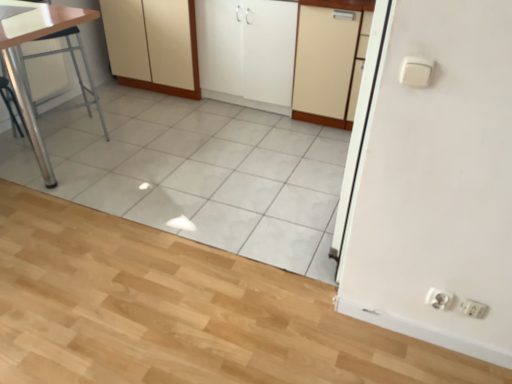
What do you see at coordinates (12, 11) in the screenshot?
I see `white glossy sink at upper left` at bounding box center [12, 11].

Describe the element at coordinates (330, 60) in the screenshot. I see `beige matte cabinet at center, the third cabinetry when ordered from left to right` at that location.

Describe the element at coordinates (153, 45) in the screenshot. This screenshot has height=384, width=512. I see `white matte cabinet at center, the 3th cabinetry when ordered from right to left` at that location.

What do you see at coordinates (473, 308) in the screenshot? I see `white plastic electric outlet at lower right, the second electric outlet positioned from the left` at bounding box center [473, 308].

This screenshot has width=512, height=384. In order to click on metallic silver table at left in this screenshot , I will do `click(18, 67)`.

Considering the positions of objects metallic silver table at left and white matte cabinet at center, the 3th cabinetry when ordered from right to left, in the image provided, who is more to the right, metallic silver table at left or white matte cabinet at center, the 3th cabinetry when ordered from right to left,?

From the viewer's perspective, white matte cabinet at center, the 3th cabinetry when ordered from right to left, appears more on the right side.

From the image's perspective, would you say metallic silver table at left is positioned over white matte cabinet at center, the first cabinetry from the left?

No.

Considering the relative sizes of metallic silver table at left and white matte cabinet at center, the first cabinetry from the left, in the image provided, is metallic silver table at left shorter than white matte cabinet at center, the first cabinetry from the left,?

No.

Which is more to the right, beige matte cabinet at center, the third cabinetry when ordered from left to right, or white plastic electric outlet at lower right, the 1th electric outlet in the left-to-right sequence?

Positioned to the right is white plastic electric outlet at lower right, the 1th electric outlet in the left-to-right sequence.

Is beige matte cabinet at center, the third cabinetry when ordered from left to right, bigger than white plastic electric outlet at lower right, the 1th electric outlet in the left-to-right sequence?

Correct, beige matte cabinet at center, the third cabinetry when ordered from left to right, is larger in size than white plastic electric outlet at lower right, the 1th electric outlet in the left-to-right sequence.

Does beige matte cabinet at center, which is the 1th cabinetry from right to left, come behind white plastic electric outlet at lower right, the 1th electric outlet in the left-to-right sequence?

Yes, beige matte cabinet at center, which is the 1th cabinetry from right to left, is further from the viewer.

Would you say white plastic electric outlet at lower right, the second electric outlet positioned from the left, is inside or outside white plastic electric outlet at lower right, the 1th electric outlet in the left-to-right sequence?

white plastic electric outlet at lower right, the second electric outlet positioned from the left, cannot be found inside white plastic electric outlet at lower right, the 1th electric outlet in the left-to-right sequence.

From a real-world perspective, between white plastic electric outlet at lower right, the second electric outlet positioned from the left, and white plastic electric outlet at lower right, positioned as the second electric outlet in right-to-left order, who is vertically higher?

white plastic electric outlet at lower right, positioned as the second electric outlet in right-to-left order, from a real-world perspective.

Which is closer, [463,310] or [435,295]?

Clearly, point [463,310] is closer to the camera than point [435,295].

Is white plastic electric outlet at lower right, the second electric outlet positioned from the left, bigger or smaller than white plastic electric outlet at lower right, positioned as the second electric outlet in right-to-left order?

Clearly, white plastic electric outlet at lower right, the second electric outlet positioned from the left, is smaller in size than white plastic electric outlet at lower right, positioned as the second electric outlet in right-to-left order.

Considering the positions of points (466, 305) and (14, 8), is point (466, 305) farther from camera compared to point (14, 8)?

That is False.

From the image's perspective, between white plastic electric outlet at lower right, the second electric outlet positioned from the left, and white glossy sink at upper left, which one is located above?

white glossy sink at upper left.

I want to click on sink above the white plastic electric outlet at lower right, which is counted as the first electric outlet, starting from the right (from a real-world perspective), so click(x=12, y=11).

Is white plastic electric outlet at lower right, the second electric outlet positioned from the left, at the left side of white glossy sink at upper left?

No.

From the image's perspective, which object appears higher, metallic silver table at left or white plastic electric outlet at lower right, which is counted as the first electric outlet, starting from the right?

metallic silver table at left.

Between metallic silver table at left and white plastic electric outlet at lower right, which is counted as the first electric outlet, starting from the right, which one has smaller width?

With smaller width is white plastic electric outlet at lower right, which is counted as the first electric outlet, starting from the right.

At what (x,y) coordinates should I click in order to perform the action: click on table that appears above the white plastic electric outlet at lower right, which is counted as the first electric outlet, starting from the right (from the image's perspective). Please return your answer as a coordinate pair (x, y). Looking at the image, I should click on (18, 67).

Can you tell me how much metallic silver table at left and beige matte cabinet at center, the third cabinetry when ordered from left to right, differ in facing direction?

61.6 degrees separate the facing orientations of metallic silver table at left and beige matte cabinet at center, the third cabinetry when ordered from left to right.

Does metallic silver table at left come in front of beige matte cabinet at center, the third cabinetry when ordered from left to right?

That is True.

Looking at their sizes, would you say metallic silver table at left is wider or thinner than beige matte cabinet at center, which is the 1th cabinetry from right to left?

Considering their sizes, metallic silver table at left looks slimmer than beige matte cabinet at center, which is the 1th cabinetry from right to left.

From the image's perspective, which is above, white plastic electric outlet at lower right, the 1th electric outlet in the left-to-right sequence, or beige matte cabinet at center, which is the 1th cabinetry from right to left?

beige matte cabinet at center, which is the 1th cabinetry from right to left, from the image's perspective.

Considering the relative positions of white plastic electric outlet at lower right, positioned as the second electric outlet in right-to-left order, and beige matte cabinet at center, which is the 1th cabinetry from right to left, in the image provided, is white plastic electric outlet at lower right, positioned as the second electric outlet in right-to-left order, to the left or to the right of beige matte cabinet at center, which is the 1th cabinetry from right to left,?

Clearly, white plastic electric outlet at lower right, positioned as the second electric outlet in right-to-left order, is on the right of beige matte cabinet at center, which is the 1th cabinetry from right to left, in the image.

Is white plastic electric outlet at lower right, positioned as the second electric outlet in right-to-left order, wider than beige matte cabinet at center, which is the 1th cabinetry from right to left?

Incorrect, the width of white plastic electric outlet at lower right, positioned as the second electric outlet in right-to-left order, does not surpass that of beige matte cabinet at center, which is the 1th cabinetry from right to left.

You are a GUI agent. You are given a task and a screenshot of the screen. Output one action in this format:
    pyautogui.click(x=<x>, y=<y>)
    Task: Click on the table below the white matte cabinet at center, the 3th cabinetry when ordered from right to left (from the image's perspective)
    
    Given the screenshot: What is the action you would take?
    pyautogui.click(x=18, y=67)

Where is `the 1st cabinetry above when counting from the white plastic electric outlet at lower right, the 1th electric outlet in the left-to-right sequence (from the image's perspective)`? the 1st cabinetry above when counting from the white plastic electric outlet at lower right, the 1th electric outlet in the left-to-right sequence (from the image's perspective) is located at coordinates point(330,60).

Considering their positions, is white glossy sink at upper left positioned closer to white matte cabinet at center, which ranks as the 2th cabinetry in right-to-left order, than metallic silver table at left?

metallic silver table at left is closer to white matte cabinet at center, which ranks as the 2th cabinetry in right-to-left order.

Looking at the image, which one is located further to metallic silver table at left, white matte cabinet at center, which ranks as the 2th cabinetry in right-to-left order, or white plastic electric outlet at lower right, positioned as the second electric outlet in right-to-left order?

Among the two, white plastic electric outlet at lower right, positioned as the second electric outlet in right-to-left order, is located further to metallic silver table at left.

From the picture: Which object lies further to the anchor point metallic silver table at left, white plastic electric outlet at lower right, the second electric outlet positioned from the left, or white plastic electric outlet at lower right, positioned as the second electric outlet in right-to-left order?

white plastic electric outlet at lower right, the second electric outlet positioned from the left, is further to metallic silver table at left.

Looking at the image, which one is located further to metallic silver table at left, white glossy sink at upper left or beige matte cabinet at center, which is the 1th cabinetry from right to left?

beige matte cabinet at center, which is the 1th cabinetry from right to left, lies further to metallic silver table at left than the other object.

When comparing their distances from beige matte cabinet at center, which is the 1th cabinetry from right to left, does metallic silver table at left or white plastic electric outlet at lower right, which is counted as the first electric outlet, starting from the right, seem closer?

metallic silver table at left is closer to beige matte cabinet at center, which is the 1th cabinetry from right to left.

From the image, which object appears to be nearer to white plastic electric outlet at lower right, positioned as the second electric outlet in right-to-left order, beige matte cabinet at center, the third cabinetry when ordered from left to right, or white matte cabinet at center, the 3th cabinetry when ordered from right to left?

Among the two, beige matte cabinet at center, the third cabinetry when ordered from left to right, is located nearer to white plastic electric outlet at lower right, positioned as the second electric outlet in right-to-left order.

From the picture: Based on their spatial positions, is white glossy sink at upper left or beige matte cabinet at center, the third cabinetry when ordered from left to right, closer to white matte cabinet at center, the 3th cabinetry when ordered from right to left?

The object closer to white matte cabinet at center, the 3th cabinetry when ordered from right to left, is beige matte cabinet at center, the third cabinetry when ordered from left to right.

Based on the photo, from the image, which object appears to be nearer to metallic silver table at left, white matte cabinet at center, the first cabinetry from the left, or white plastic electric outlet at lower right, which is counted as the first electric outlet, starting from the right?

Among the two, white matte cabinet at center, the first cabinetry from the left, is located nearer to metallic silver table at left.

You are a GUI agent. You are given a task and a screenshot of the screen. Output one action in this format:
    pyautogui.click(x=<x>, y=<y>)
    Task: Click on the electric outlet between white glossy sink at upper left and white plastic electric outlet at lower right, the second electric outlet positioned from the left, from left to right
    The image size is (512, 384).
    Given the screenshot: What is the action you would take?
    pyautogui.click(x=439, y=299)

The height and width of the screenshot is (384, 512). In order to click on cabinetry situated between white glossy sink at upper left and white matte cabinet at center, the second cabinetry viewed from the left, from left to right in this screenshot , I will do `click(153, 45)`.

This screenshot has width=512, height=384. I want to click on cabinetry between white matte cabinet at center, the second cabinetry viewed from the left, and white plastic electric outlet at lower right, positioned as the second electric outlet in right-to-left order, from top to bottom, so click(330, 60).

The image size is (512, 384). Identify the location of electric outlet that lies between beige matte cabinet at center, the third cabinetry when ordered from left to right, and white plastic electric outlet at lower right, the second electric outlet positioned from the left, from top to bottom. (439, 299).